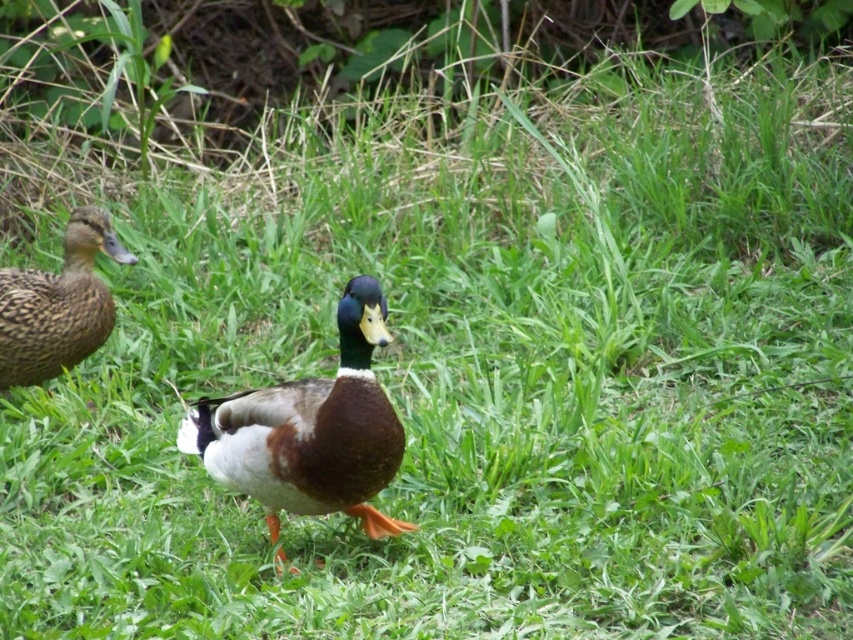
You are a birdwatcher observing the ducks in the image. You notice the shiny brown duck at center and the brown speckled feathers at left. Which duck is positioned more to the east if the image is oriented with the sun coming from the west?

The shiny brown duck at center is positioned more to the east because it is to the right of the brown speckled feathers at left, and since the sun is coming from the west, right in the image corresponds to east.

You are a birdwatcher trying to observe both the shiny brown duck at center and the brown speckled feathers at left. If you want to get a closer look at both ducks without moving your position, which duck should you focus your binoculars on first to ensure you can see them clearly?

The shiny brown duck at center is closer to you than the brown speckled feathers at left, so you should focus your binoculars on the shiny brown duck at center first to ensure you can see them clearly.

You are standing in the grassy area and see the shiny brown duck at center and the brown speckled feathers at left. Which object is closer to the ground?

The shiny brown duck at center is closer to the ground because it is positioned below the brown speckled feathers at left.